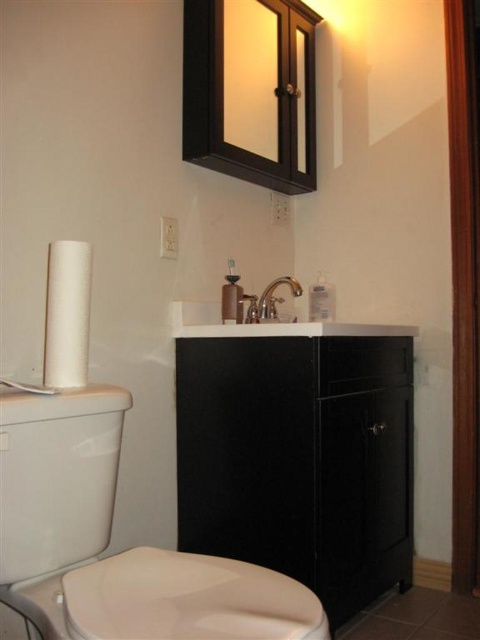
In the bathroom scene, there is a white glossy toilet bowl at left and a white matte toilet paper at left. Which object is positioned further to the left?

Result: The white matte toilet paper at left is positioned further to the left than the white glossy toilet bowl at left.

You are standing in the bathroom and notice two points marked on the floor. The first point is at coordinate point(269, 307) and the second at point(245, 317). If you were to walk towards the medicine cabinet above the vanity, which point would you step on first?

Point(245, 317) would be stepped on first because it is in front of point(269, 307).

You are a bathroom designer assessing the layout. The white matte toilet paper at left and the silver metallic faucet at center are both visible in the mirror of the medicine cabinet. Which object appears taller in the reflection?

The white matte toilet paper at left appears taller in the reflection because it is taller than the silver metallic faucet at center in reality.